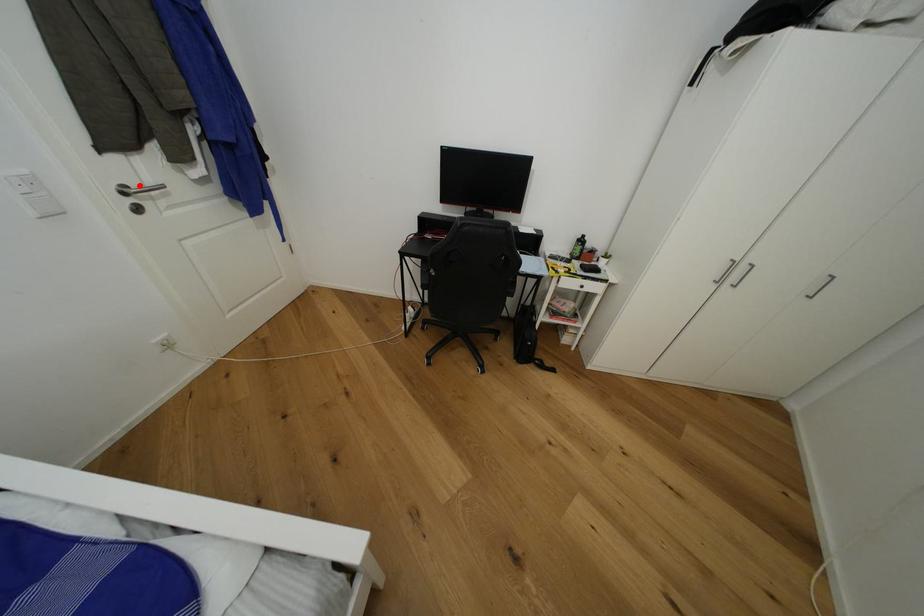
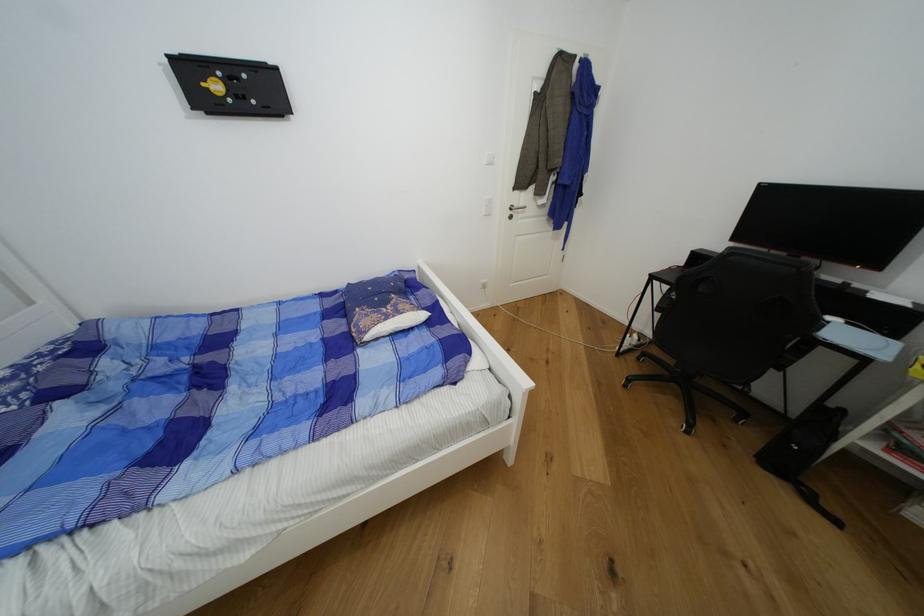
Where in the second image is the point corresponding to the highlighted location from the first image?

(521, 207)